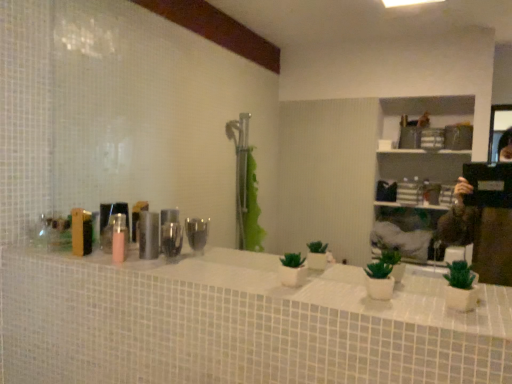
The width and height of the screenshot is (512, 384). I want to click on free space in front of metallic cylindrical container at center, which is the first toiletry in right-to-left order, so click(x=154, y=266).